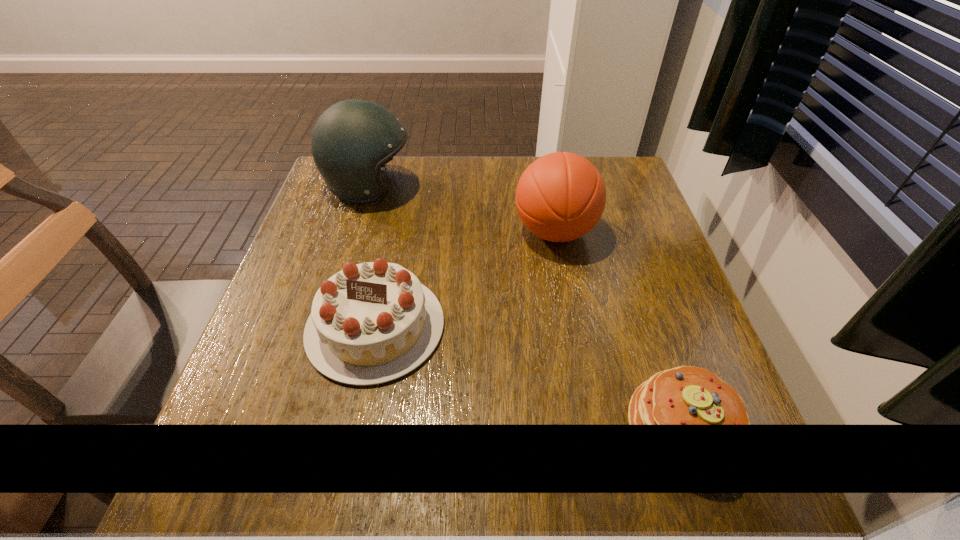
Find the location of a particular element. The width and height of the screenshot is (960, 540). object located at the near edge is located at coordinates (686, 395).

Locate an element on the screen. This screenshot has width=960, height=540. football helmet that is at the left edge is located at coordinates (352, 140).

Locate an element on the screen. The width and height of the screenshot is (960, 540). birthday cake located at the left edge is located at coordinates (370, 323).

You are a GUI agent. You are given a task and a screenshot of the screen. Output one action in this format:
    pyautogui.click(x=<x>, y=<y>)
    Task: Click on the basketball at the right edge
    This screenshot has height=540, width=960.
    Given the screenshot: What is the action you would take?
    pyautogui.click(x=561, y=196)

Identify the location of pancake positioned at the right edge. (686, 395).

Image resolution: width=960 pixels, height=540 pixels. Find the location of `object that is positioned at the far left corner`. object that is positioned at the far left corner is located at coordinates (352, 140).

Locate an element on the screen. The width and height of the screenshot is (960, 540). object at the far right corner is located at coordinates (561, 196).

Locate an element on the screen. object located at the near right corner is located at coordinates (686, 395).

This screenshot has height=540, width=960. I want to click on free location at the near edge, so click(x=610, y=475).

This screenshot has width=960, height=540. In order to click on vacant space at the left edge of the desktop in this screenshot , I will do `click(330, 242)`.